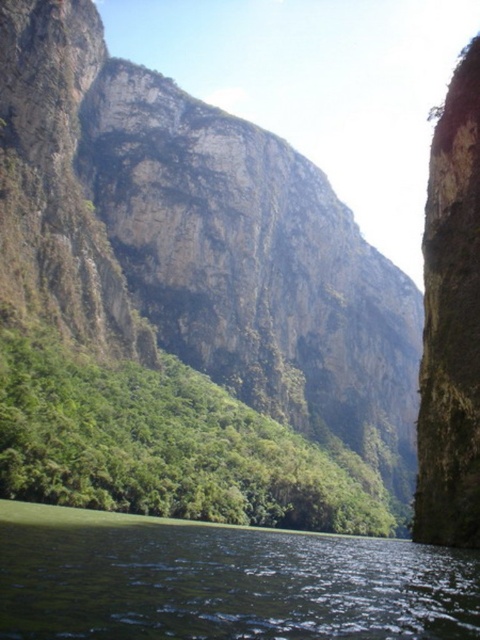
Question: Which point is farther to the camera?

Choices:
 (A) (226, 438)
 (B) (371, 250)

Answer: (B)

Question: Can you confirm if rough stone mountain at center is wider than green leafy vegetation at center?

Choices:
 (A) no
 (B) yes

Answer: (B)

Question: Where is rough stone mountain at center located in relation to green leafy vegetation at center in the image?

Choices:
 (A) above
 (B) below

Answer: (A)

Question: Which point is farther to the camera?

Choices:
 (A) green leafy vegetation at center
 (B) green smooth water at lower center
 (C) rough stone mountain at center

Answer: (C)

Question: Can you confirm if green smooth water at lower center is wider than green leafy vegetation at center?

Choices:
 (A) no
 (B) yes

Answer: (A)

Question: Which of the following is the closest to the observer?

Choices:
 (A) green smooth water at lower center
 (B) green leafy vegetation at center

Answer: (A)